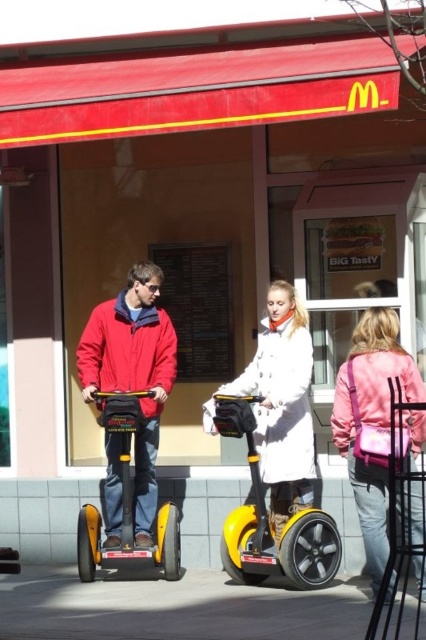
You are standing at the entrance of the McDonalds and want to move from the matte red jacket at center to the yellow matte scooter at center. Can you walk directly between them without needing to move around any obstacles?

The matte red jacket at center and yellow matte scooter at center are 32.26 inches apart, so you cannot walk directly between them without needing to move around any obstacles because the distance is too narrow for a person to pass through comfortably.

You are a delivery person who needs to secure a package on your yellow matte scooter at center. The package is too large to fit on the scooter itself. Where should you place it so that it doesn not fall off, considering the position of the matte red jacket at center?

The matte red jacket at center is located above the yellow matte scooter at center, so you should place the package below the matte red jacket at center to ensure it stays secure and doesn not fall off.

You are a delivery person who needs to pick up a package from the pink fabric purse at lower right and deliver it to the yellow matte scooter at center. Based on the scene description, can you determine the direction you need to move the package from the purse to the scooter?

The pink fabric purse at lower right is to the right of the yellow matte scooter at center, so you need to move the package to the left to deliver it from the pink fabric purse at lower right to the yellow matte scooter at center.